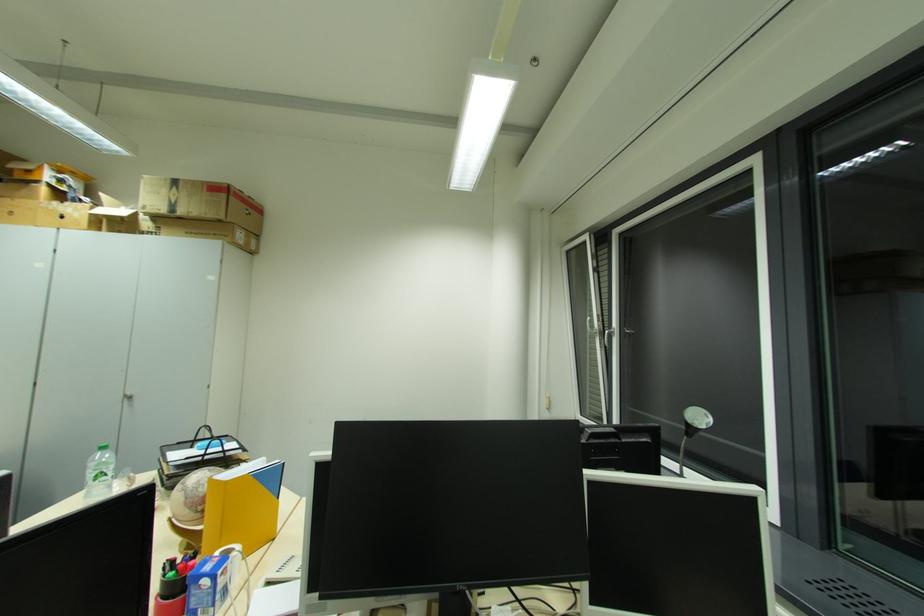
Image resolution: width=924 pixels, height=616 pixels. I want to click on cabinet handle, so click(x=128, y=397).